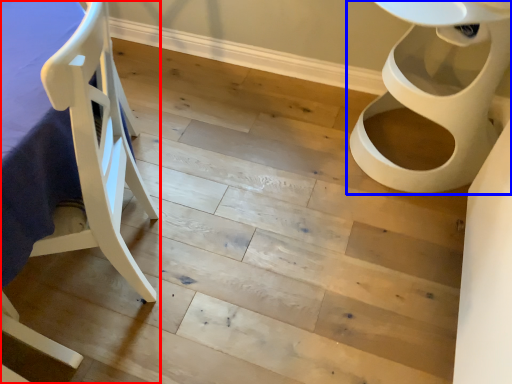
Question: Which point is closer to the camera, furniture (highlighted by a red box) or toilet (highlighted by a blue box)?

Choices:
 (A) furniture
 (B) toilet

Answer: (A)